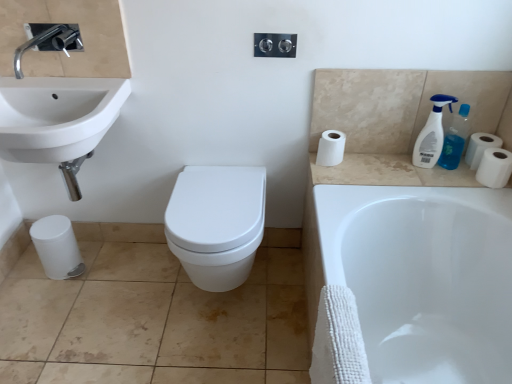
What do you see at coordinates (494, 168) in the screenshot?
I see `white matte toilet paper at right, the 3th toilet paper from the left` at bounding box center [494, 168].

I want to click on translucent plastic spray bottle at upper right, acting as the first cleaning product starting from the right, so click(455, 139).

What do you see at coordinates (455, 139) in the screenshot?
I see `translucent plastic spray bottle at upper right, acting as the first cleaning product starting from the right` at bounding box center [455, 139].

At what (x,y) coordinates should I click in order to perform the action: click on white glossy toilet at center. Please return your answer as a coordinate pair (x, y). The width and height of the screenshot is (512, 384). Looking at the image, I should click on (216, 223).

The height and width of the screenshot is (384, 512). What do you see at coordinates (275, 45) in the screenshot?
I see `black plastic dispenser at upper center` at bounding box center [275, 45].

Locate an element on the screen. white glossy sink at upper left is located at coordinates (58, 120).

Is white glossy sink at upper left located within white glossy toilet at center?

No.

Between white glossy toilet at center and white glossy sink at upper left, which one has more height?

With more height is white glossy toilet at center.

Are white glossy toilet at center and white glossy sink at upper left beside each other?

No, white glossy toilet at center is not with white glossy sink at upper left.

From a real-world perspective, is white glossy toilet at center under white glossy sink at upper left?

Yes, from a real-world perspective, white glossy toilet at center is under white glossy sink at upper left.

Based on the photo, considering the sizes of objects white plastic spray bottle at upper right, arranged as the second cleaning product when viewed from the right, and white glossy sink at upper left in the image provided, who is wider, white plastic spray bottle at upper right, arranged as the second cleaning product when viewed from the right, or white glossy sink at upper left?

white glossy sink at upper left is wider.

In the scene shown: Is white plastic spray bottle at upper right, arranged as the second cleaning product when viewed from the right, far from white glossy sink at upper left?

That's right, there is a large distance between white plastic spray bottle at upper right, arranged as the second cleaning product when viewed from the right, and white glossy sink at upper left.

Considering the relative positions of white plastic spray bottle at upper right, arranged as the second cleaning product when viewed from the right, and white glossy sink at upper left in the image provided, is white plastic spray bottle at upper right, arranged as the second cleaning product when viewed from the right, to the left of white glossy sink at upper left from the viewer's perspective?

In fact, white plastic spray bottle at upper right, arranged as the second cleaning product when viewed from the right, is to the right of white glossy sink at upper left.

Which of these two, white matte toilet paper at right, the 3th toilet paper from the left, or white glossy bathtub at lower right, is bigger?

white glossy bathtub at lower right.

Can you confirm if white matte toilet paper at right, which appears as the second toilet paper when viewed from the right, is wider than white glossy bathtub at lower right?

Incorrect, the width of white matte toilet paper at right, which appears as the second toilet paper when viewed from the right, does not surpass that of white glossy bathtub at lower right.

Is white matte toilet paper at right, the 3th toilet paper from the left, further to the viewer compared to white glossy bathtub at lower right?

Yes, it is.

Can you confirm if white matte toilet paper at right, positioned as the 3th toilet paper in top-to-bottom order, is positioned to the right of white glossy bathtub at lower right?

Indeed, white matte toilet paper at right, positioned as the 3th toilet paper in top-to-bottom order, is positioned on the right side of white glossy bathtub at lower right.

Which is farther from the camera, (447,147) or (262,46)?

The point (447,147) is farther.

Looking at the image, does translucent plastic spray bottle at upper right, the second cleaning product when ordered from left to right, seem bigger or smaller compared to black plastic dispenser at upper center?

Considering their sizes, translucent plastic spray bottle at upper right, the second cleaning product when ordered from left to right, takes up more space than black plastic dispenser at upper center.

Who is shorter, translucent plastic spray bottle at upper right, the second cleaning product when ordered from left to right, or black plastic dispenser at upper center?

Standing shorter between the two is black plastic dispenser at upper center.

Consider the image. From the image's perspective, is translucent plastic spray bottle at upper right, the second cleaning product when ordered from left to right, under black plastic dispenser at upper center?

Yes.

Is translucent plastic spray bottle at upper right, acting as the first cleaning product starting from the right, not inside white glossy sink at upper left?

Yes, translucent plastic spray bottle at upper right, acting as the first cleaning product starting from the right, is outside of white glossy sink at upper left.

Is point (458, 125) closer or farther from the camera than point (121, 87)?

Point (458, 125) is farther from the camera than point (121, 87).

Based on the photo, from the image's perspective, is translucent plastic spray bottle at upper right, acting as the first cleaning product starting from the right, positioned above or below white glossy sink at upper left?

translucent plastic spray bottle at upper right, acting as the first cleaning product starting from the right, is above white glossy sink at upper left.

Is translucent plastic spray bottle at upper right, the second cleaning product when ordered from left to right, not close to white glossy sink at upper left?

translucent plastic spray bottle at upper right, the second cleaning product when ordered from left to right, is positioned a significant distance from white glossy sink at upper left.

Is white matte toilet paper at right, acting as the 2th toilet paper starting from the top, at the right side of translucent plastic spray bottle at upper right, the second cleaning product when ordered from left to right?

Yes, white matte toilet paper at right, acting as the 2th toilet paper starting from the top, is to the right of translucent plastic spray bottle at upper right, the second cleaning product when ordered from left to right.

Is white matte toilet paper at right, which appears as the 3th toilet paper when ordered from the bottom, next to translucent plastic spray bottle at upper right, the second cleaning product when ordered from left to right?

Indeed, white matte toilet paper at right, which appears as the 3th toilet paper when ordered from the bottom, and translucent plastic spray bottle at upper right, the second cleaning product when ordered from left to right, are beside each other and touching.

Is white matte toilet paper at right, placed as the first toilet paper when sorted from right to left, situated inside translucent plastic spray bottle at upper right, acting as the first cleaning product starting from the right, or outside?

white matte toilet paper at right, placed as the first toilet paper when sorted from right to left, is not enclosed by translucent plastic spray bottle at upper right, acting as the first cleaning product starting from the right.

Which of these two, white matte toilet paper at right, acting as the 2th toilet paper starting from the top, or white matte toilet paper at upper right, which is counted as the fourth toilet paper, starting from the bottom, is wider?

white matte toilet paper at upper right, which is counted as the fourth toilet paper, starting from the bottom, is wider.

Is white matte toilet paper at right, acting as the 2th toilet paper starting from the top, bigger than white matte toilet paper at upper right, the 3th toilet paper positioned from the right?

No.

Is white matte toilet paper at right, the fourth toilet paper positioned from the left, oriented away from white matte toilet paper at upper right, which is counted as the fourth toilet paper, starting from the bottom?

No, white matte toilet paper at right, the fourth toilet paper positioned from the left, is not facing the opposite direction of white matte toilet paper at upper right, which is counted as the fourth toilet paper, starting from the bottom.

Locate an element on the screen. Image resolution: width=512 pixels, height=384 pixels. sink that is above the white glossy toilet at center (from the image's perspective) is located at coordinates (58, 120).

Image resolution: width=512 pixels, height=384 pixels. I want to click on sink located underneath the white plastic spray bottle at upper right, arranged as the second cleaning product when viewed from the right (from a real-world perspective), so click(58, 120).

Looking at this image, looking at the image, which one is located further to white glossy sink at upper left, white textured towel at lower right or white matte toilet paper at right, arranged as the second toilet paper when ordered from the bottom?

The object further to white glossy sink at upper left is white matte toilet paper at right, arranged as the second toilet paper when ordered from the bottom.

Considering their positions, is white matte toilet paper at lower left, which is the fourth toilet paper in top-to-bottom order, positioned further to white marble countertop at upper right than black plastic dispenser at upper center?

white matte toilet paper at lower left, which is the fourth toilet paper in top-to-bottom order, lies further to white marble countertop at upper right than the other object.

When comparing their distances from white glossy bathtub at lower right, does white matte toilet paper at lower left, the 1th toilet paper in the bottom-to-top sequence, or translucent plastic spray bottle at upper right, acting as the first cleaning product starting from the right, seem closer?

Based on the image, translucent plastic spray bottle at upper right, acting as the first cleaning product starting from the right, appears to be nearer to white glossy bathtub at lower right.

Looking at the image, which one is located closer to beige tile at lower left, white textured towel at lower right or white marble countertop at upper right?

The object closer to beige tile at lower left is white textured towel at lower right.

Based on the photo, looking at the image, which one is located closer to white glossy bathtub at lower right, white matte toilet paper at right, which appears as the second toilet paper when viewed from the right, or white textured towel at lower right?

white textured towel at lower right lies closer to white glossy bathtub at lower right than the other object.

Which object lies further to the anchor point white matte toilet paper at upper right, the 3th toilet paper positioned from the right, white matte toilet paper at lower left, which appears as the 1th toilet paper when viewed from the left, or white marble countertop at upper right?

white matte toilet paper at lower left, which appears as the 1th toilet paper when viewed from the left.

Which object lies nearer to the anchor point white matte toilet paper at lower left, the 1th toilet paper in the bottom-to-top sequence, black plastic dispenser at upper center or black metallic faucet at upper left?

black metallic faucet at upper left lies closer to white matte toilet paper at lower left, the 1th toilet paper in the bottom-to-top sequence, than the other object.

Which object lies further to the anchor point white matte toilet paper at right, positioned as the 3th toilet paper in top-to-bottom order, white glossy toilet at center or white glossy bathtub at lower right?

white glossy toilet at center is further to white matte toilet paper at right, positioned as the 3th toilet paper in top-to-bottom order.

Identify the location of toilet paper between white marble countertop at upper right and white matte toilet paper at right, placed as the first toilet paper when sorted from right to left. (494, 168).

I want to click on tile between black metallic faucet at upper left and white textured towel at lower right vertically, so click(153, 316).

Locate an element on the screen. tap situated between white glossy sink at upper left and white marble countertop at upper right from left to right is located at coordinates (48, 41).

Find the location of a particular element. This screenshot has height=384, width=512. counter top between white glossy sink at upper left and white matte toilet paper at right, which appears as the 3th toilet paper when ordered from the bottom is located at coordinates (389, 172).